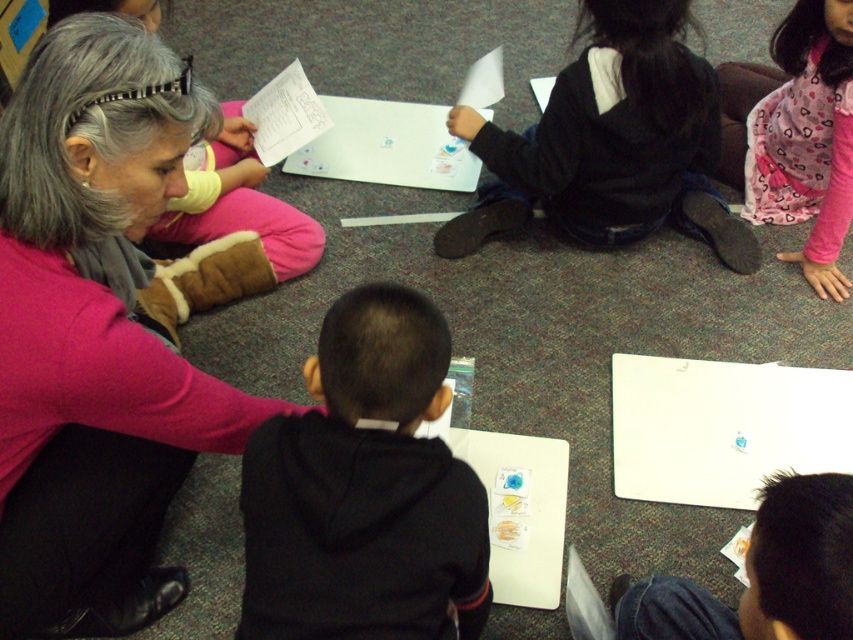
Question: Is pink fleece sweater at upper left thinner than denim jeans at lower right?

Choices:
 (A) yes
 (B) no

Answer: (B)

Question: Estimate the real-world distances between objects in this image. Which object is closer to the denim jeans at lower right?

Choices:
 (A) black hoodie at upper center
 (B) pink fleece sweater at upper left
 (C) black fleece hoodie at center
 (D) pink heart-patterned dress at upper right

Answer: (C)

Question: Which point is farther to the camera?

Choices:
 (A) (846, 170)
 (B) (308, 420)

Answer: (A)

Question: Does pink fleece sweater at upper left come behind black fleece hoodie at center?

Choices:
 (A) yes
 (B) no

Answer: (A)

Question: Can you confirm if black hoodie at upper center is positioned above denim jeans at lower right?

Choices:
 (A) no
 (B) yes

Answer: (B)

Question: Which of the following is the farthest from the observer?

Choices:
 (A) pos(817,595)
 (B) pos(770,214)

Answer: (B)